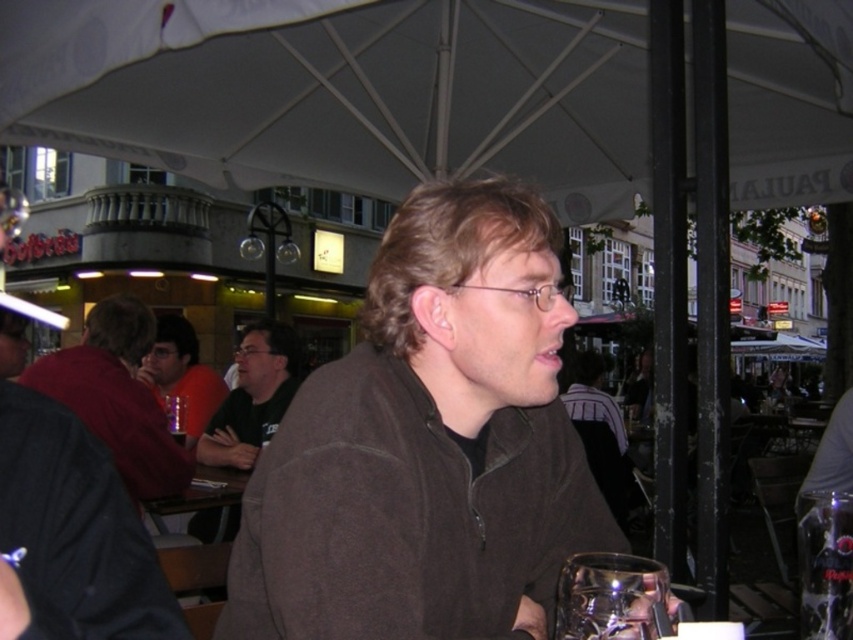
You are a fashion designer analyzing this image. You need to determine the spatial relationship between the dark brown leather jacket at upper left and the matte black shirt at center. Which one is positioned higher in the image?

The dark brown leather jacket at upper left is positioned higher than the matte black shirt at center in the image.

You are a tailor measuring a customer for a new jacket. The customer is wearing a brown fleece jacket at center and a matte black shirt at center. Which garment should you measure first to ensure proper fit?

You should measure the brown fleece jacket at center first because it might be wider than the matte black shirt at center, ensuring the new jacket accommodates the existing width.